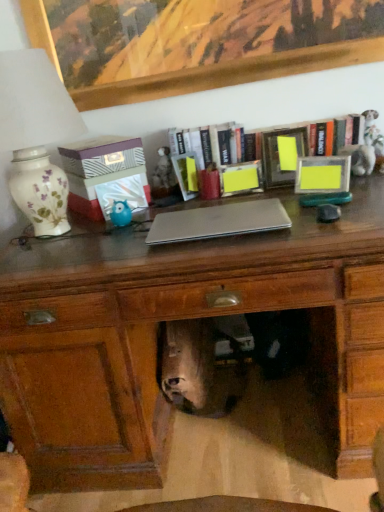
This screenshot has height=512, width=384. Describe the element at coordinates (186, 362) in the screenshot. I see `shiny silver skull at center` at that location.

Where is `silver metallic laptop at center`? Image resolution: width=384 pixels, height=512 pixels. silver metallic laptop at center is located at coordinates [218, 221].

Image resolution: width=384 pixels, height=512 pixels. What do you see at coordinates (36, 136) in the screenshot?
I see `white floral ceramic lamp at left` at bounding box center [36, 136].

At what (x,y) coordinates should I click in order to perform the action: click on wooden bookshelf at upper center. Please return your answer as a coordinate pair (x, y). The height and width of the screenshot is (512, 384). Looking at the image, I should click on (259, 149).

This screenshot has width=384, height=512. Describe the element at coordinates (323, 180) in the screenshot. I see `matte yellow picture frame at right, which is the first picture frame in right-to-left order` at that location.

The width and height of the screenshot is (384, 512). Identify the location of shiny silver skull at center. (186, 362).

Which of these two, matte blue plastic owl at center-left or shiny silver skull at center, is wider?

Wider between the two is shiny silver skull at center.

Where is `animal in front of the matte blue plastic owl at center-left`? The width and height of the screenshot is (384, 512). animal in front of the matte blue plastic owl at center-left is located at coordinates (186, 362).

Between matte blue plastic owl at center-left and shiny silver skull at center, which one has smaller size?

matte blue plastic owl at center-left is smaller.

Does point (127, 205) lie behind point (174, 346)?

No, it is not.

Looking at this image, how distant is white floral ceramic lamp at left from silver metallic laptop at center?

white floral ceramic lamp at left is 48.78 centimeters from silver metallic laptop at center.

Which object is wider, white floral ceramic lamp at left or silver metallic laptop at center?

white floral ceramic lamp at left.

From a real-world perspective, relative to silver metallic laptop at center, is white floral ceramic lamp at left vertically above or below?

Clearly, from a real-world perspective, white floral ceramic lamp at left is above silver metallic laptop at center.

From the image's perspective, which one is positioned lower, white floral ceramic lamp at left or silver metallic laptop at center?

silver metallic laptop at center, from the image's perspective.

Identify the location of the 1st picture frame directly above the shiny silver skull at center (from a real-world perspective). (323, 180).

Between shiny silver skull at center and matte yellow picture frame at right, the 2th picture frame viewed from the top, which one has smaller width?

With smaller width is matte yellow picture frame at right, the 2th picture frame viewed from the top.

From the image's perspective, is shiny silver skull at center below matte yellow picture frame at right, arranged as the 1th picture frame when ordered from the bottom?

Yes.

Is silver metallic laptop at center inside the boundaries of wooden bookshelf at upper center, or outside?

silver metallic laptop at center lies outside wooden bookshelf at upper center.

Is silver metallic laptop at center looking in the opposite direction of wooden bookshelf at upper center?

Yes.

Which is more to the right, silver metallic laptop at center or wooden bookshelf at upper center?

Positioned to the right is wooden bookshelf at upper center.

Does silver metallic laptop at center have a lesser height compared to matte yellow picture frame at right, the second picture frame when ordered from left to right?

Yes, silver metallic laptop at center is shorter than matte yellow picture frame at right, the second picture frame when ordered from left to right.

The width and height of the screenshot is (384, 512). Find the location of `laptop in front of the matte yellow picture frame at right, which is the first picture frame in right-to-left order`. laptop in front of the matte yellow picture frame at right, which is the first picture frame in right-to-left order is located at coordinates (218, 221).

In the scene shown: From a real-world perspective, is silver metallic laptop at center on top of matte yellow picture frame at right, which is the first picture frame in right-to-left order?

Incorrect, from a real-world perspective, silver metallic laptop at center is lower than matte yellow picture frame at right, which is the first picture frame in right-to-left order.

Which is more to the right, silver metallic laptop at center or matte yellow picture frame at right, which is the first picture frame in right-to-left order?

From the viewer's perspective, matte yellow picture frame at right, which is the first picture frame in right-to-left order, appears more on the right side.

How much distance is there between matte yellow picture frame at right, the 2th picture frame viewed from the top, and wooden bookshelf at upper center?

matte yellow picture frame at right, the 2th picture frame viewed from the top, is 5.57 inches away from wooden bookshelf at upper center.

Identify the location of picture frame on the right of wooden bookshelf at upper center. Image resolution: width=384 pixels, height=512 pixels. (323, 180).

Which is closer to the camera, (326, 189) or (291, 134)?

The point (326, 189) is in front.

Considering the positions of objects matte yellow picture frame at right, the 2th picture frame viewed from the top, and wooden bookshelf at upper center in the image provided, who is more to the left, matte yellow picture frame at right, the 2th picture frame viewed from the top, or wooden bookshelf at upper center?

From the viewer's perspective, wooden bookshelf at upper center appears more on the left side.

Considering the points (299, 199) and (97, 100), which point is behind, point (299, 199) or point (97, 100)?

Point (97, 100)

Who is bigger, matte yellow picture frame at right, the 2th picture frame viewed from the top, or wooden picture frame at upper center, the second picture frame viewed from the right?

With larger size is wooden picture frame at upper center, the second picture frame viewed from the right.

Does matte yellow picture frame at right, the second picture frame when ordered from left to right, turn towards wooden picture frame at upper center, the second picture frame positioned from the bottom?

No, matte yellow picture frame at right, the second picture frame when ordered from left to right, is not oriented towards wooden picture frame at upper center, the second picture frame positioned from the bottom.

Are matte yellow picture frame at right, which is the first picture frame in right-to-left order, and wooden picture frame at upper center, the second picture frame positioned from the bottom, beside each other?

No, matte yellow picture frame at right, which is the first picture frame in right-to-left order, is not next to wooden picture frame at upper center, the second picture frame positioned from the bottom.

This screenshot has height=512, width=384. What are the coordinates of `animal below the matte blue plastic owl at center-left (from the image's perspective)` in the screenshot? It's located at (186, 362).

There is a silver metallic laptop at center. Where is `table lamp above it (from a real-world perspective)`? table lamp above it (from a real-world perspective) is located at coordinates (36, 136).

Considering their positions, is matte yellow picture frame at right, the 2th picture frame viewed from the top, positioned closer to shiny silver skull at center than silver metallic laptop at center?

silver metallic laptop at center lies closer to shiny silver skull at center than the other object.

Which object lies nearer to the anchor point white floral ceramic lamp at left, wooden bookshelf at upper center or shiny silver skull at center?

wooden bookshelf at upper center lies closer to white floral ceramic lamp at left than the other object.

Considering their positions, is matte blue plastic owl at center-left positioned closer to matte yellow picture frame at right, the second picture frame when ordered from left to right, than wooden bookshelf at upper center?

wooden bookshelf at upper center is closer to matte yellow picture frame at right, the second picture frame when ordered from left to right.

Based on their spatial positions, is matte blue plastic owl at center-left or matte wooden desk at center closer to matte yellow picture frame at right, which is the first picture frame in right-to-left order?

matte wooden desk at center.

Which object lies nearer to the anchor point matte yellow picture frame at right, the 2th picture frame viewed from the top, silver metallic laptop at center or white floral ceramic lamp at left?

The object closer to matte yellow picture frame at right, the 2th picture frame viewed from the top, is silver metallic laptop at center.

Estimate the real-world distances between objects in this image. Which object is closer to matte wooden desk at center, matte yellow picture frame at right, which is the first picture frame in right-to-left order, or shiny silver skull at center?

shiny silver skull at center is closer to matte wooden desk at center.

Looking at the image, which one is located closer to shiny silver skull at center, wooden bookshelf at upper center or matte blue plastic owl at center-left?

matte blue plastic owl at center-left.

From the picture: Which object lies nearer to the anchor point wooden picture frame at upper center, the second picture frame positioned from the bottom, white floral ceramic lamp at left or matte wooden desk at center?

white floral ceramic lamp at left.

Locate an element on the screen. The width and height of the screenshot is (384, 512). laptop between white floral ceramic lamp at left and wooden bookshelf at upper center is located at coordinates (218, 221).

The width and height of the screenshot is (384, 512). What are the coordinates of `table lamp between wooden picture frame at upper center, the first picture frame in the left-to-right sequence, and shiny silver skull at center from top to bottom` in the screenshot? It's located at (36, 136).

I want to click on laptop between wooden picture frame at upper center, the second picture frame viewed from the right, and shiny silver skull at center, in the vertical direction, so click(x=218, y=221).

The width and height of the screenshot is (384, 512). I want to click on bookcase that lies between wooden picture frame at upper center, the second picture frame positioned from the bottom, and shiny silver skull at center from top to bottom, so click(x=259, y=149).